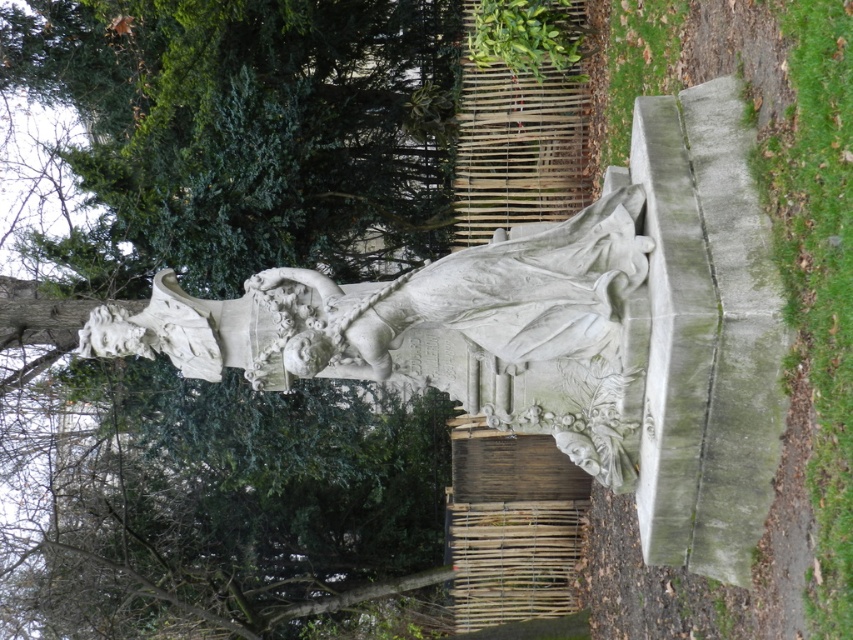
Question: Is green leafy tree at upper left in front of white stone statue at center?

Choices:
 (A) yes
 (B) no

Answer: (B)

Question: Is green leafy tree at upper left positioned before white stone statue at center?

Choices:
 (A) no
 (B) yes

Answer: (A)

Question: Does green leafy tree at upper left appear on the right side of white stone statue at center?

Choices:
 (A) yes
 (B) no

Answer: (B)

Question: Which point is closer to the camera?

Choices:
 (A) (311, 310)
 (B) (296, 157)

Answer: (A)

Question: Among these objects, which one is nearest to the camera?

Choices:
 (A) white stone statue at center
 (B) green leafy tree at upper left

Answer: (A)